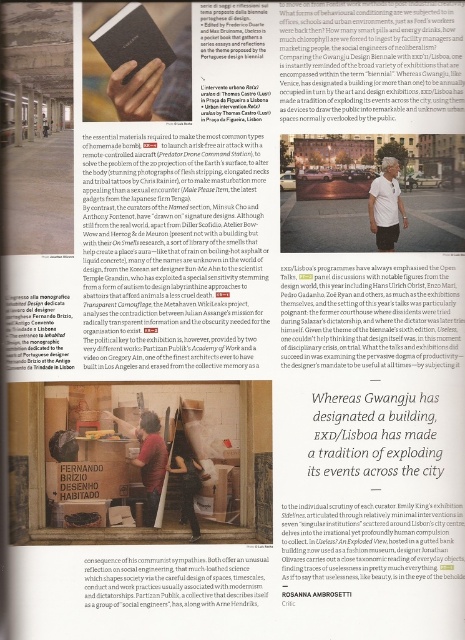
Question: Is white cotton shirt at center positioned at the back of dark brown leather jacket at center?

Choices:
 (A) no
 (B) yes

Answer: (B)

Question: Which object is the closest to the dark brown leather jacket at center?

Choices:
 (A) wooden table at center
 (B) matte black book at upper left
 (C) white cotton shirt at center

Answer: (A)

Question: Among these objects, which one is farthest from the camera?

Choices:
 (A) white cotton shirt at center
 (B) dark brown leather jacket at center
 (C) wooden table at center

Answer: (A)

Question: Can you confirm if matte black book at upper left is positioned to the right of dark brown leather jacket at center?

Choices:
 (A) yes
 (B) no

Answer: (B)

Question: Which point is closer to the camera taking this photo?

Choices:
 (A) (369, 212)
 (B) (191, 472)
 (C) (160, 486)
 (D) (159, 45)

Answer: (D)

Question: Is matte black book at upper left smaller than wooden table at center?

Choices:
 (A) yes
 (B) no

Answer: (B)